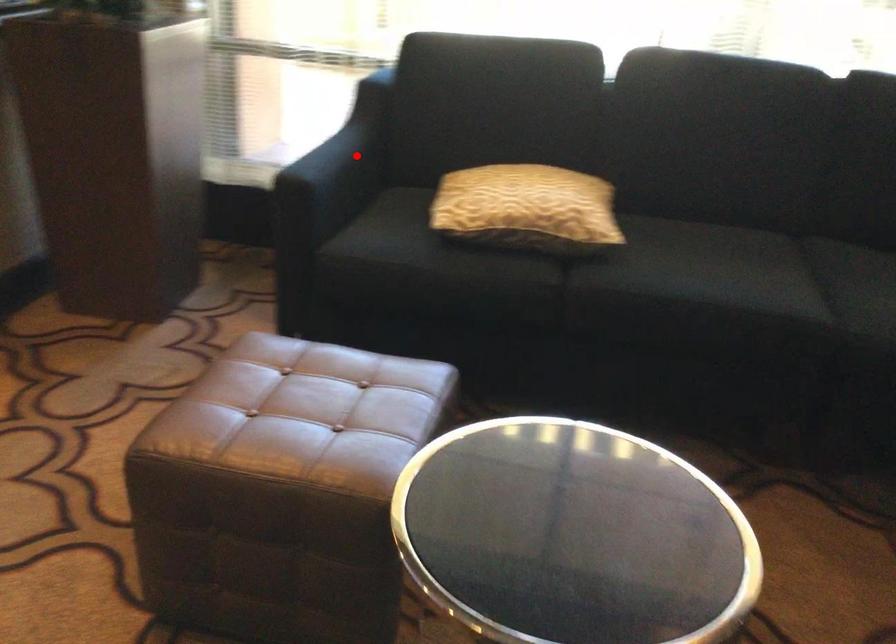
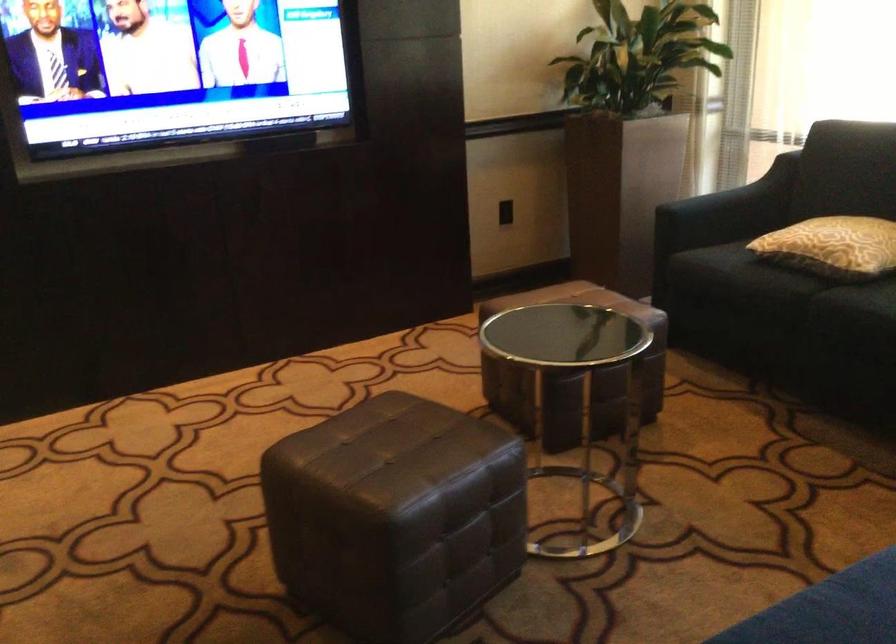
The point at the highlighted location is marked in the first image. Where is the corresponding point in the second image?

(742, 196)